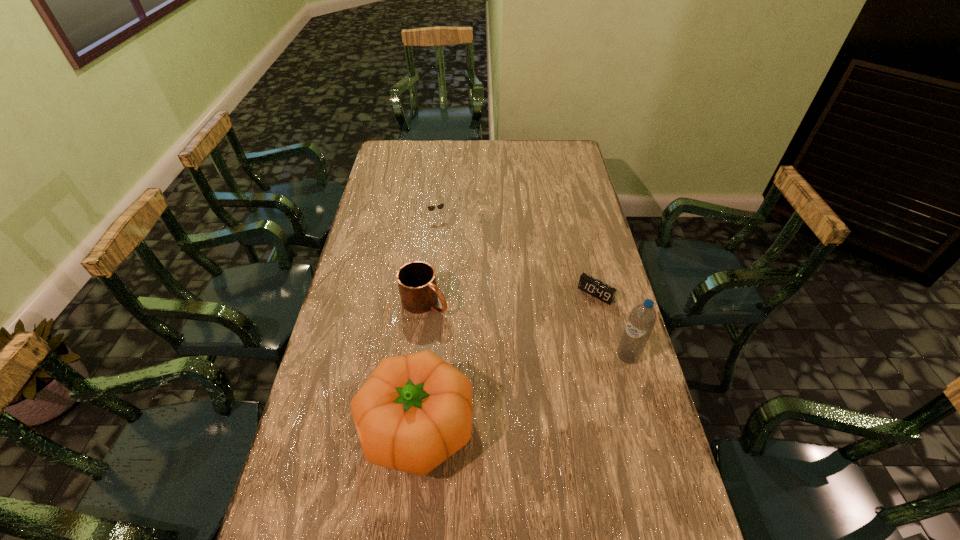
Find the location of a particular element. The width and height of the screenshot is (960, 540). blank space located 0.340m on the front-facing side of the shortest object is located at coordinates (527, 374).

I want to click on free space located on the front-facing side of the shortest object, so click(516, 386).

Locate an element on the screen. The image size is (960, 540). vacant point located on the front-facing side of the shortest object is located at coordinates (576, 316).

Locate an element on the screen. Image resolution: width=960 pixels, height=540 pixels. free space located on the side of the mug with the handle is located at coordinates (467, 329).

The image size is (960, 540). In order to click on vacant area located 0.070m on the side of the mug with the handle in this screenshot , I will do `click(459, 325)`.

The height and width of the screenshot is (540, 960). What are the coordinates of `free space located 0.270m on the side of the mug with the handle` in the screenshot? It's located at click(511, 360).

You are a GUI agent. You are given a task and a screenshot of the screen. Output one action in this format:
    pyautogui.click(x=<x>, y=<y>)
    Task: Click on the free point located 0.260m in front of the lenses of the sunglasses
    The width and height of the screenshot is (960, 540).
    Given the screenshot: What is the action you would take?
    pyautogui.click(x=463, y=268)

This screenshot has height=540, width=960. What are the coordinates of `free space located 0.320m in front of the lenses of the sunglasses` in the screenshot? It's located at (468, 280).

At what (x,y) coordinates should I click in order to perform the action: click on free space located in front of the lenses of the sunglasses. Please return your answer as a coordinate pair (x, y). Image resolution: width=960 pixels, height=540 pixels. Looking at the image, I should click on (474, 294).

What are the coordinates of `object positioned at the left edge` in the screenshot? It's located at (414, 411).